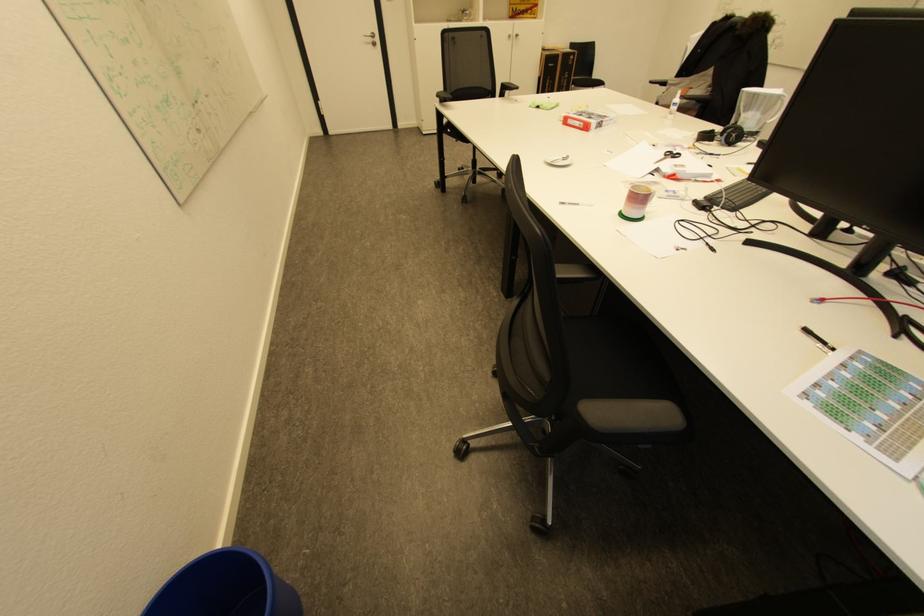
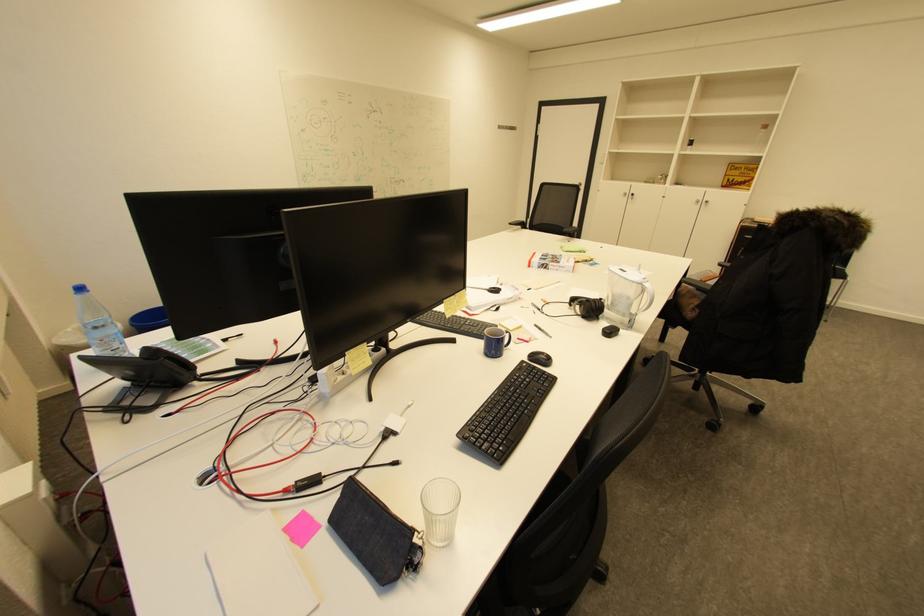
Find the pixel in the second image that matches [516,37] in the first image.

(703, 201)